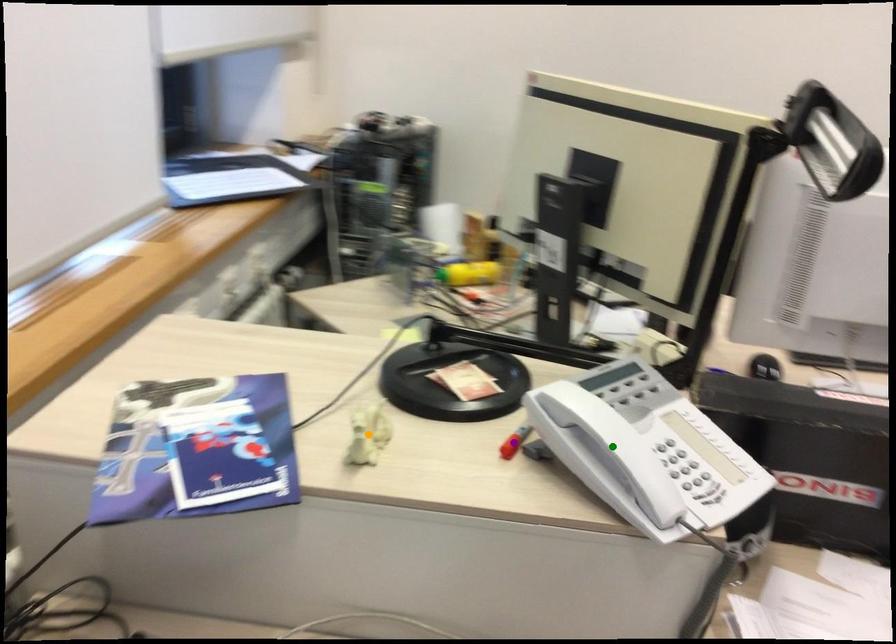
From the picture: Order these from nearest to farthest:
A) orange point
B) purple point
C) green point

purple point, orange point, green point